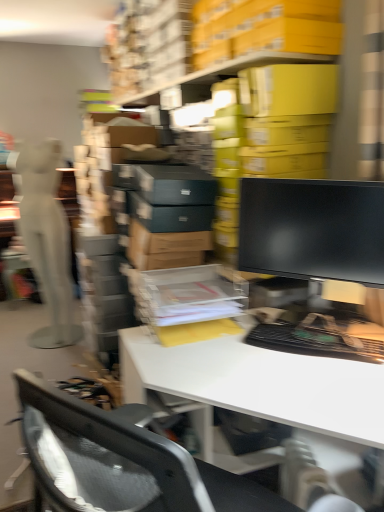
Question: Are white glossy desk at center and black glossy monitor at center making contact?

Choices:
 (A) yes
 (B) no

Answer: (B)

Question: Is white glossy desk at center not near black glossy monitor at center?

Choices:
 (A) no
 (B) yes

Answer: (A)

Question: Can you confirm if white glossy desk at center is bigger than black glossy monitor at center?

Choices:
 (A) yes
 (B) no

Answer: (A)

Question: Can you confirm if white glossy desk at center is smaller than black glossy monitor at center?

Choices:
 (A) yes
 (B) no

Answer: (B)

Question: Could you tell me if white glossy desk at center is facing black glossy monitor at center?

Choices:
 (A) yes
 (B) no

Answer: (B)

Question: Is the position of white glossy desk at center less distant than that of black glossy monitor at center?

Choices:
 (A) yes
 (B) no

Answer: (A)

Question: Is white matte mannequin at left positioned beyond the bounds of white glossy desk at center?

Choices:
 (A) no
 (B) yes

Answer: (B)

Question: Is the position of white matte mannequin at left more distant than that of white glossy desk at center?

Choices:
 (A) no
 (B) yes

Answer: (B)

Question: Does white matte mannequin at left have a larger size compared to white glossy desk at center?

Choices:
 (A) no
 (B) yes

Answer: (A)

Question: Can you confirm if white matte mannequin at left is shorter than white glossy desk at center?

Choices:
 (A) no
 (B) yes

Answer: (A)

Question: From a real-world perspective, is white matte mannequin at left below white glossy desk at center?

Choices:
 (A) no
 (B) yes

Answer: (A)

Question: From a real-world perspective, is white matte mannequin at left physically above white glossy desk at center?

Choices:
 (A) no
 (B) yes

Answer: (B)

Question: Is white glossy desk at center taller than white matte mannequin at left?

Choices:
 (A) yes
 (B) no

Answer: (B)